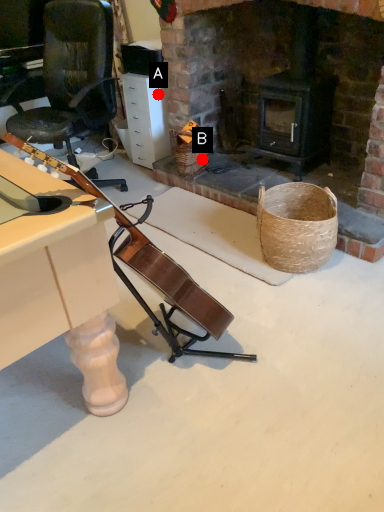
Question: Two points are circled on the image, labeled by A and B beside each circle. Which of the following is the farthest from the observer?

Choices:
 (A) A is further
 (B) B is further

Answer: (A)